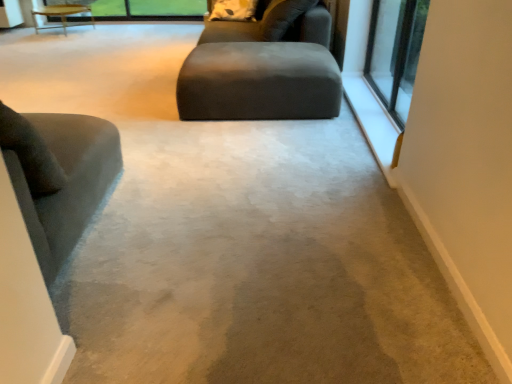
Find the location of a particular element. vacant space to the right of velvet gray chair at left is located at coordinates (198, 229).